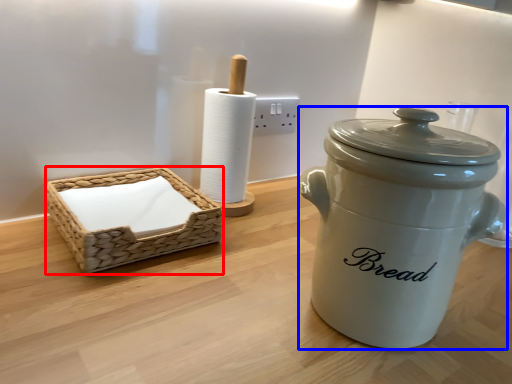
Question: Which object is closer to the camera taking this photo, basket (highlighted by a red box) or crock pot (highlighted by a blue box)?

Choices:
 (A) basket
 (B) crock pot

Answer: (B)